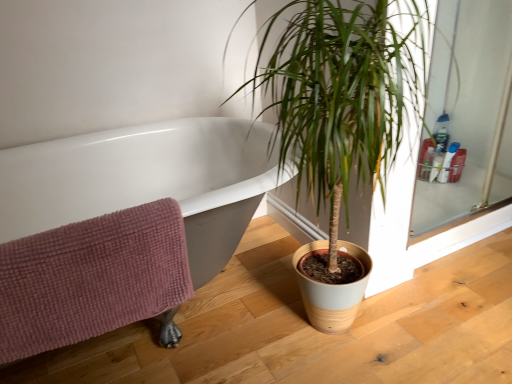
The image size is (512, 384). What are the coordinates of `vacant area situated below green leafy plant at center (from a real-world perspective)` in the screenshot? It's located at (354, 346).